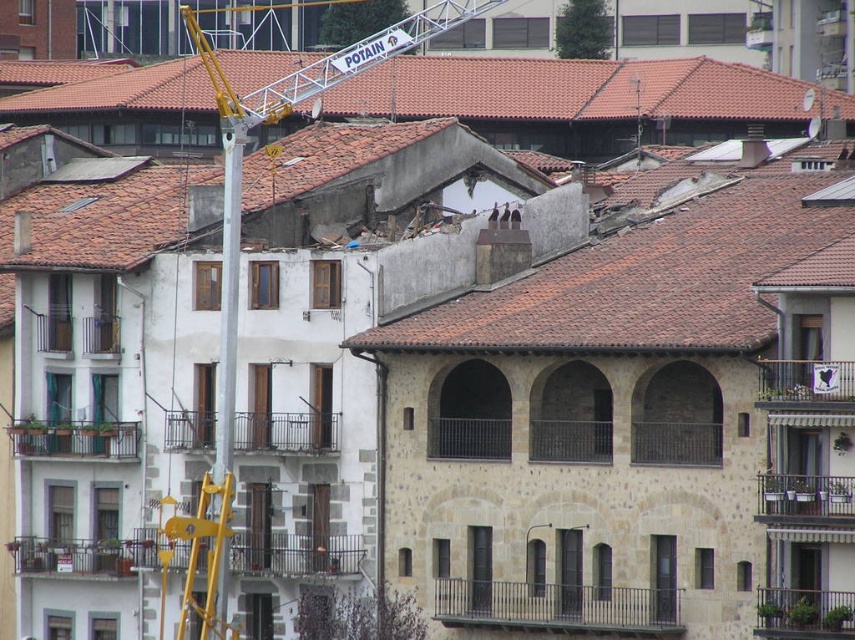
Question: Which point is closer to the camera?

Choices:
 (A) (711, 237)
 (B) (467, 93)
 (C) (187, 616)
 (D) (223, 278)

Answer: (D)

Question: Based on their relative distances, which object is nearer to the brown tile roof at upper center?

Choices:
 (A) yellow metallic ladder at center
 (B) terracotta tiled roof at center

Answer: (B)

Question: Estimate the real-world distances between objects in this image. Which object is closer to the brown tile roof at upper center?

Choices:
 (A) terracotta tiled roof at center
 (B) yellow metallic ladder at center
 (C) silver metallic pole at center

Answer: (C)

Question: Is brown tile roof at upper center positioned in front of yellow metallic ladder at center?

Choices:
 (A) no
 (B) yes

Answer: (A)

Question: Can you confirm if terracotta tiled roof at center is positioned to the right of silver metallic pole at center?

Choices:
 (A) no
 (B) yes

Answer: (B)

Question: Where is terracotta tiled roof at center located in relation to silver metallic pole at center in the image?

Choices:
 (A) above
 (B) below

Answer: (B)